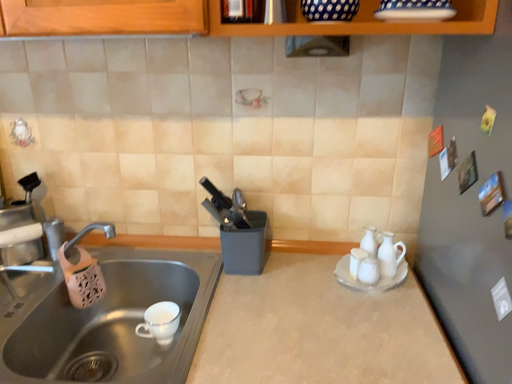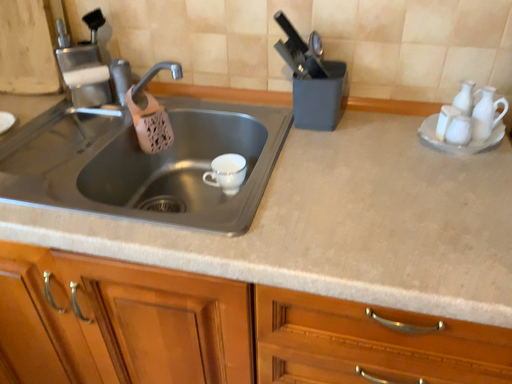
Question: Which way did the camera rotate in the video?

Choices:
 (A) rotated upward
 (B) rotated downward

Answer: (B)